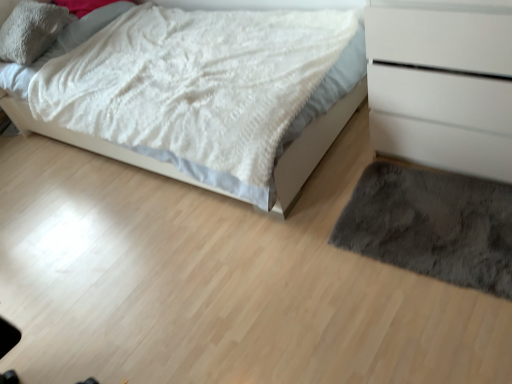
Question: Should I look upward or downward to see dark gray shaggy rug at lower right?

Choices:
 (A) up
 (B) down

Answer: (B)

Question: Is white fluffy blanket at upper left positioned with its back to white matte chest of drawers at right?

Choices:
 (A) no
 (B) yes

Answer: (A)

Question: From the image's perspective, is white fluffy blanket at upper left on white matte chest of drawers at right?

Choices:
 (A) yes
 (B) no

Answer: (A)

Question: Is the depth of white fluffy blanket at upper left less than that of white matte chest of drawers at right?

Choices:
 (A) no
 (B) yes

Answer: (A)

Question: Does white fluffy blanket at upper left appear on the left side of white matte chest of drawers at right?

Choices:
 (A) yes
 (B) no

Answer: (A)

Question: From the image's perspective, does white fluffy blanket at upper left appear lower than white matte chest of drawers at right?

Choices:
 (A) yes
 (B) no

Answer: (B)

Question: Is white fluffy blanket at upper left next to white matte chest of drawers at right?

Choices:
 (A) no
 (B) yes

Answer: (A)

Question: From the image's perspective, is white matte chest of drawers at right below dark gray shaggy rug at lower right?

Choices:
 (A) no
 (B) yes

Answer: (A)

Question: Considering the relative sizes of white matte chest of drawers at right and dark gray shaggy rug at lower right in the image provided, is white matte chest of drawers at right wider than dark gray shaggy rug at lower right?

Choices:
 (A) yes
 (B) no

Answer: (A)

Question: Can you confirm if white matte chest of drawers at right is shorter than dark gray shaggy rug at lower right?

Choices:
 (A) yes
 (B) no

Answer: (B)

Question: Is white matte chest of drawers at right at the left side of dark gray shaggy rug at lower right?

Choices:
 (A) yes
 (B) no

Answer: (B)

Question: Is white matte chest of drawers at right positioned far away from dark gray shaggy rug at lower right?

Choices:
 (A) no
 (B) yes

Answer: (A)

Question: Can you confirm if white matte chest of drawers at right is positioned to the right of dark gray shaggy rug at lower right?

Choices:
 (A) no
 (B) yes

Answer: (B)

Question: Is dark gray shaggy rug at lower right facing towards soft gray plush pillow at upper left?

Choices:
 (A) no
 (B) yes

Answer: (A)